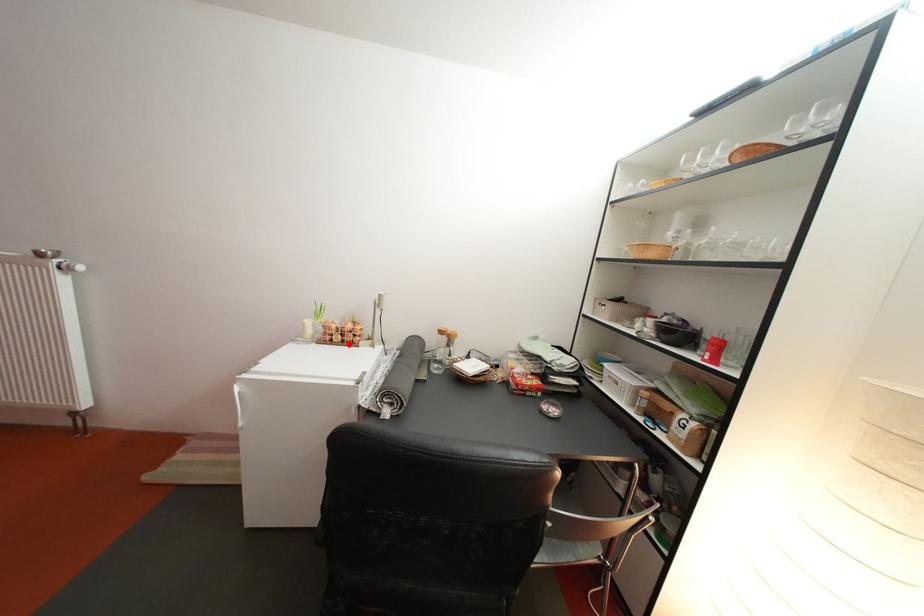
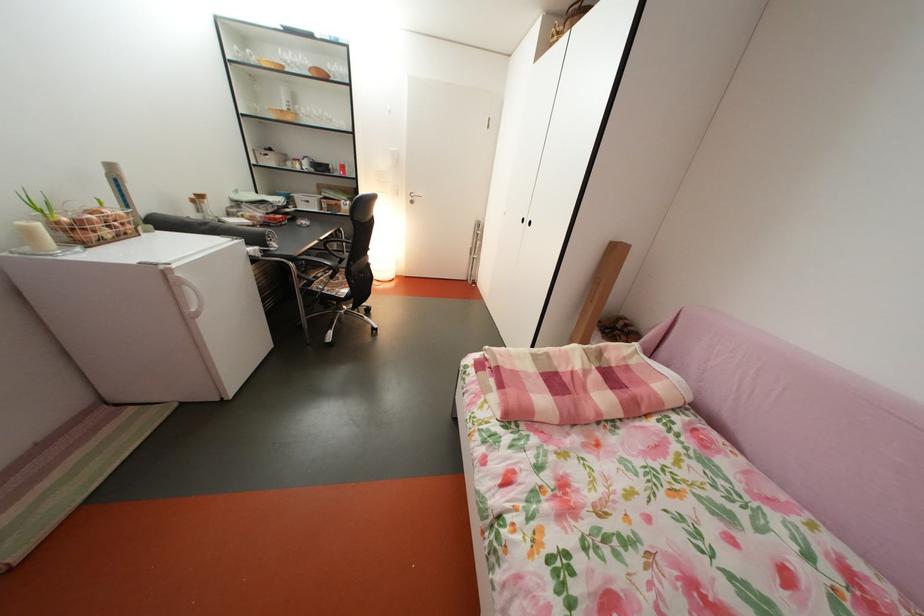
Locate, in the second image, the point that corresponds to the highlighted location in the first image.

(118, 238)